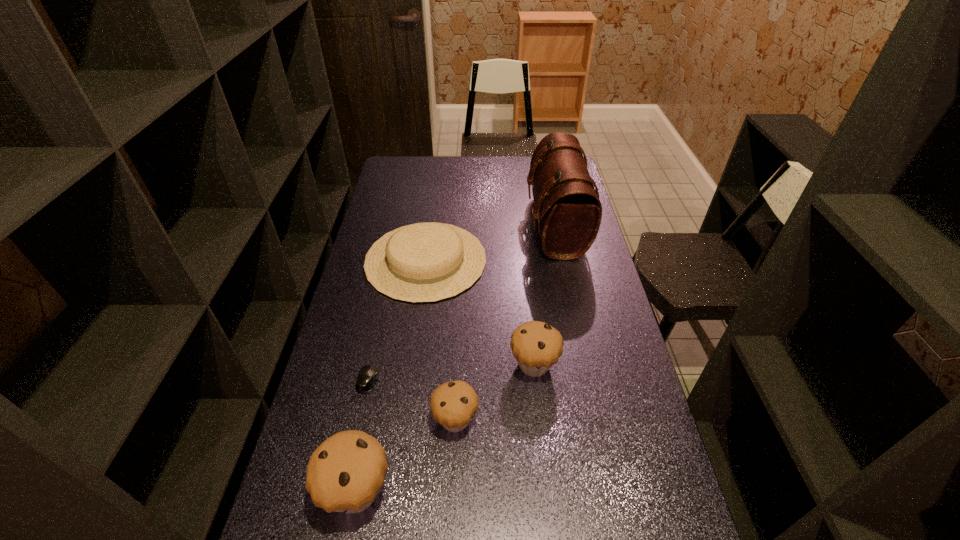
Find the location of a particular element. free space between the satchel and the nearest object is located at coordinates (456, 358).

The image size is (960, 540). I want to click on free space between the farthest muffin and the sunhat, so click(x=480, y=312).

I want to click on vacant area that lies between the satchel and the shortest object, so click(462, 303).

This screenshot has width=960, height=540. Find the location of `free space that is in between the tallest object and the second nearest object`. free space that is in between the tallest object and the second nearest object is located at coordinates (505, 323).

The height and width of the screenshot is (540, 960). In order to click on vacant space in between the shortest object and the fifth farthest object in this screenshot , I will do `click(412, 400)`.

Locate which object ranks fourth in proximity to the satchel. Please provide its 2D coordinates. Your answer should be formatted as a tuple, i.e. [(x, y)], where the tuple contains the x and y coordinates of a point satisfying the conditions above.

[(368, 375)]

The width and height of the screenshot is (960, 540). I want to click on object that is the fourth closest to the sunhat, so click(x=453, y=404).

The width and height of the screenshot is (960, 540). Identify the location of muffin that is the nearest to the tallest object. (536, 346).

Identify the location of muffin that is the closest one to the leftmost muffin. Image resolution: width=960 pixels, height=540 pixels. (453, 404).